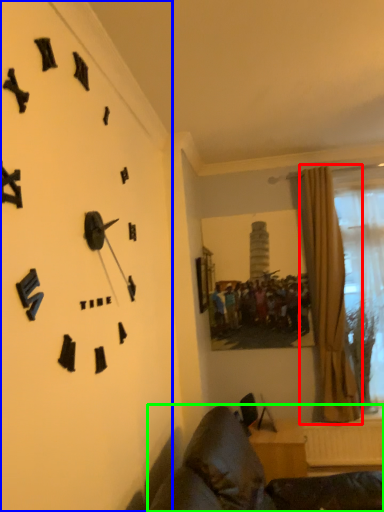
Question: Which object is positioned farthest from curtain (highlighted by a red box)? Select from wall clock (highlighted by a blue box) and furniture (highlighted by a green box).

Choices:
 (A) wall clock
 (B) furniture

Answer: (A)